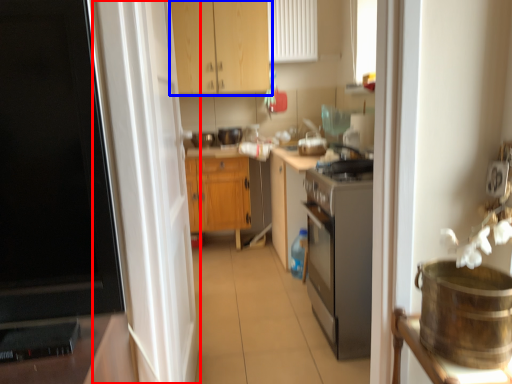
Question: Among these objects, which one is nearest to the camera, screen door (highlighted by a red box) or cabinetry (highlighted by a blue box)?

Choices:
 (A) screen door
 (B) cabinetry

Answer: (A)